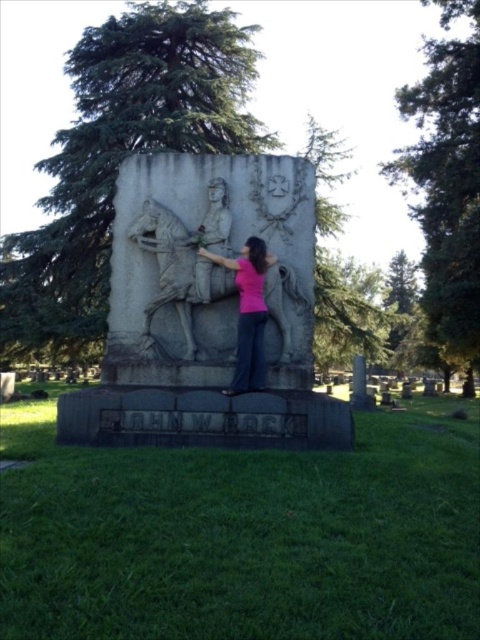
You are a photographer positioned at the back of the cemetery. You want to take a photo of the gray stone relief at center and the pink fabric at center. Which object will appear closer to you in the photo?

The gray stone relief at center will appear closer to you in the photo because it is further to the viewer than the pink fabric at center, meaning it is positioned nearer to your current position.

You are a photographer trying to capture the interaction between the gray stone relief at center and the pink fabric at center. Based on their positions, which object is above the other?

The gray stone relief at center is positioned over the pink fabric at center, so the gray stone relief is above the pink fabric.